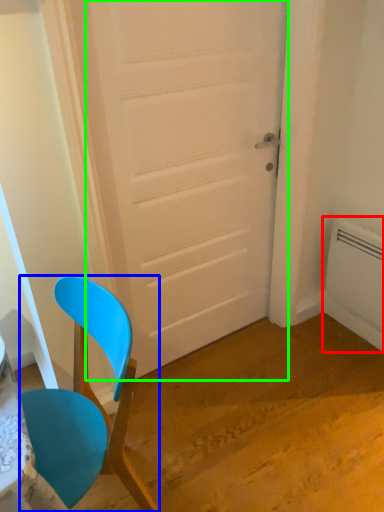
Question: Based on their relative distances, which object is farther from radiator (highlighted by a red box)? Choose from chair (highlighted by a blue box) and door (highlighted by a green box).

Choices:
 (A) chair
 (B) door

Answer: (A)